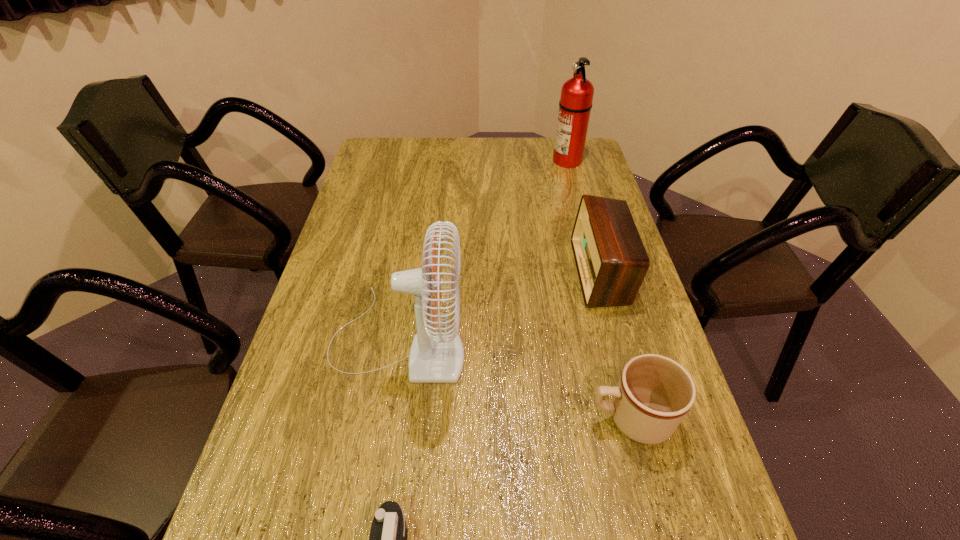
The image size is (960, 540). What are the coordinates of `fire extinguisher` in the screenshot? It's located at (575, 104).

This screenshot has height=540, width=960. Find the location of `fan`. fan is located at coordinates (435, 357).

I want to click on the third tallest object, so (x=611, y=260).

You are a GUI agent. You are given a task and a screenshot of the screen. Output one action in this format:
    pyautogui.click(x=<x>, y=<y>)
    Task: Click on the fourth tallest object
    
    Given the screenshot: What is the action you would take?
    pyautogui.click(x=654, y=393)

Find the location of a particular element. Image resolution: width=960 pixels, height=540 pixels. vacant space located 0.320m at the nozzle of the farthest object is located at coordinates (467, 160).

Find the location of a particular element. vacant area situated 0.380m at the nozzle of the farthest object is located at coordinates (450, 160).

Find the location of a particular element. vacant position located 0.180m at the nozzle of the farthest object is located at coordinates (504, 160).

I want to click on vacant space located on the front-facing side of the fan, so click(x=623, y=340).

Find the location of `free space located 0.370m on the front-facing side of the radio receiver`. free space located 0.370m on the front-facing side of the radio receiver is located at coordinates (444, 272).

This screenshot has width=960, height=540. Find the location of `vacant area situated 0.350m on the front-facing side of the radio receiver`. vacant area situated 0.350m on the front-facing side of the radio receiver is located at coordinates (451, 272).